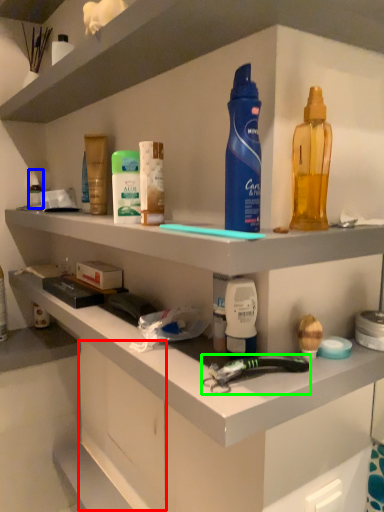
Question: Based on their relative distances, which object is farther from drawer (highlighted by a red box)? Choose from toiletry (highlighted by a blue box) and tool (highlighted by a green box).

Choices:
 (A) toiletry
 (B) tool

Answer: (A)